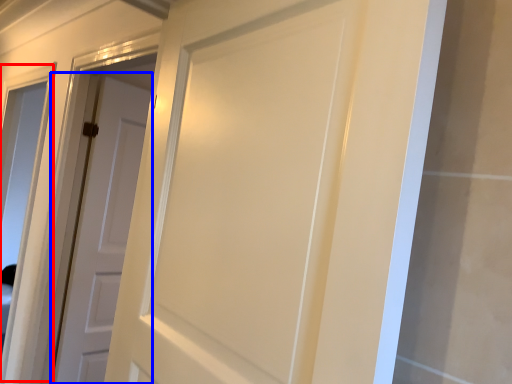
Question: Which object appears farthest to the camera in this image, window (highlighted by a red box) or door (highlighted by a blue box)?

Choices:
 (A) window
 (B) door

Answer: (A)